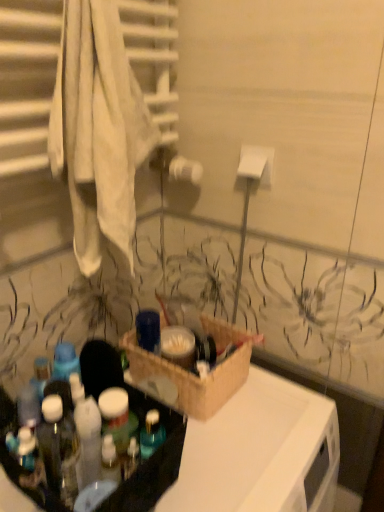
At what (x,y) coordinates should I click in order to perform the action: click on free location to the right of woven basket at center. Please return your answer as a coordinate pair (x, y). The image size is (384, 512). Looking at the image, I should click on (281, 404).